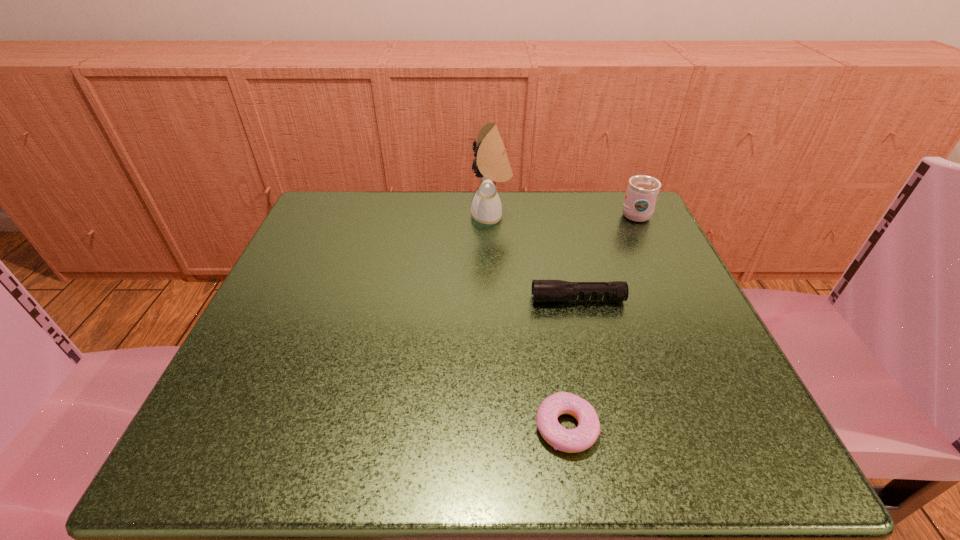
I want to click on free space between the third tallest object and the second tallest object, so click(606, 256).

Locate an element on the screen. free space between the doughnut and the doll is located at coordinates (528, 322).

The width and height of the screenshot is (960, 540). In order to click on vacant area that lies between the second nearest object and the third shortest object in this screenshot , I will do `click(606, 256)`.

In order to click on free spot between the leftmost object and the nearest object in this screenshot , I will do `click(528, 322)`.

Locate an element on the screen. This screenshot has height=540, width=960. vacant region between the doughnut and the flashlight is located at coordinates (572, 363).

This screenshot has height=540, width=960. Identify the location of free space between the nearest object and the tallest object. (528, 322).

In order to click on free spot between the doughnut and the second tallest object in this screenshot , I will do `click(600, 321)`.

In order to click on free spot between the third farthest object and the leftmost object in this screenshot , I will do (534, 258).

The width and height of the screenshot is (960, 540). I want to click on vacant point located between the tallest object and the flashlight, so click(x=534, y=258).

Locate an element on the screen. The image size is (960, 540). empty space that is in between the third shortest object and the shortest object is located at coordinates (600, 321).